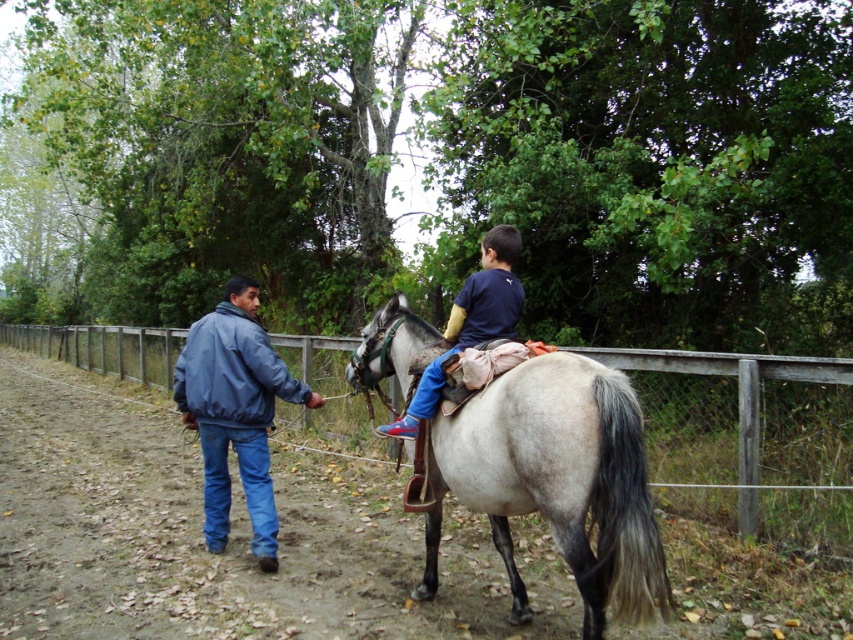
Question: Is wooden fence at center bigger than blue denim jeans at center?

Choices:
 (A) no
 (B) yes

Answer: (B)

Question: Does wooden fence at center appear on the right side of gray matte/suede horse at center?

Choices:
 (A) no
 (B) yes

Answer: (A)

Question: Which object is closer to the camera taking this photo?

Choices:
 (A) blue denim jacket at left
 (B) blue denim jeans at center

Answer: (B)

Question: Is gray matte/suede horse at center thinner than blue denim jacket at left?

Choices:
 (A) no
 (B) yes

Answer: (A)

Question: Which of the following is the closest to the observer?

Choices:
 (A) (593, 557)
 (B) (422, 392)
 (C) (204, 396)
 (D) (682, 444)

Answer: (A)

Question: Among these points, which one is farthest from the camera?

Choices:
 (A) (732, 401)
 (B) (500, 259)
 (C) (560, 529)
 (D) (218, 380)

Answer: (A)